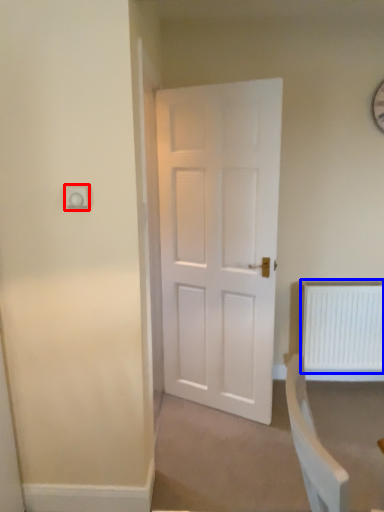
Question: Which of the following is the farthest to the observer, electric outlet (highlighted by a red box) or radiator (highlighted by a blue box)?

Choices:
 (A) electric outlet
 (B) radiator

Answer: (B)